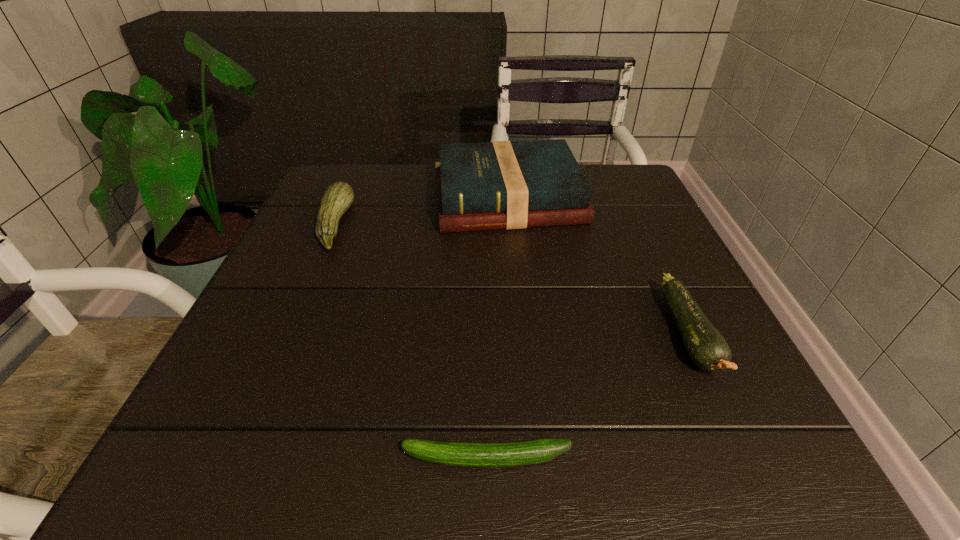
The width and height of the screenshot is (960, 540). Identify the location of the tallest object. (493, 185).

Identify the location of the leftmost object. (338, 197).

This screenshot has height=540, width=960. Identify the location of the farthest zucchini. (338, 197).

This screenshot has height=540, width=960. In order to click on the rightmost object in this screenshot , I will do `click(707, 348)`.

Find the location of a particular element. The height and width of the screenshot is (540, 960). the rightmost zucchini is located at coordinates (707, 348).

The height and width of the screenshot is (540, 960). Identify the location of the shortest object. (507, 454).

Locate an element on the screen. The height and width of the screenshot is (540, 960). the nearest object is located at coordinates (507, 454).

The width and height of the screenshot is (960, 540). I want to click on free space located 0.080m on the right of the tallest object, so click(x=616, y=199).

In order to click on free space located at the stem end of the leftmost zucchini in this screenshot , I will do `click(439, 225)`.

You are a GUI agent. You are given a task and a screenshot of the screen. Output one action in this format:
    pyautogui.click(x=<x>, y=<y>)
    Task: Click on the vacant region located at the blossom end of the second nearest object
    The image size is (960, 540).
    Given the screenshot: What is the action you would take?
    pyautogui.click(x=753, y=469)